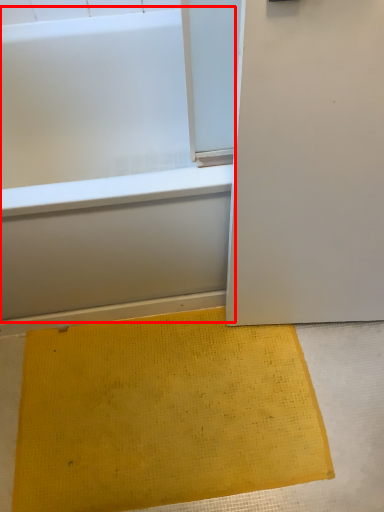
Question: Considering the relative positions of bathtub (annotated by the red box) and doormat in the image provided, where is bathtub (annotated by the red box) located with respect to the staircase?

Choices:
 (A) left
 (B) right

Answer: (A)